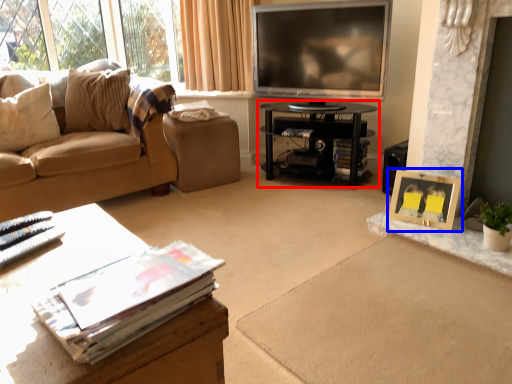
Question: Among these objects, which one is nearest to the camera, table (highlighted by a red box) or picture frame (highlighted by a blue box)?

Choices:
 (A) table
 (B) picture frame

Answer: (B)